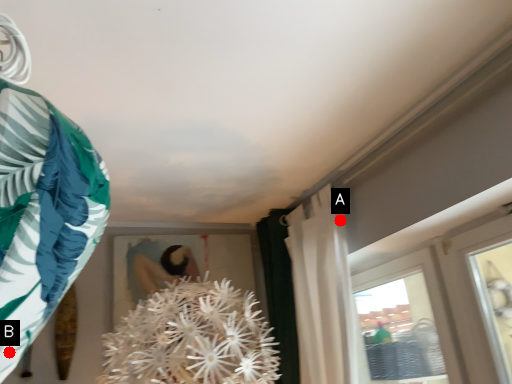
Question: Two points are circled on the image, labeled by A and B beside each circle. Which point is farther to the camera?

Choices:
 (A) A is further
 (B) B is further

Answer: (A)